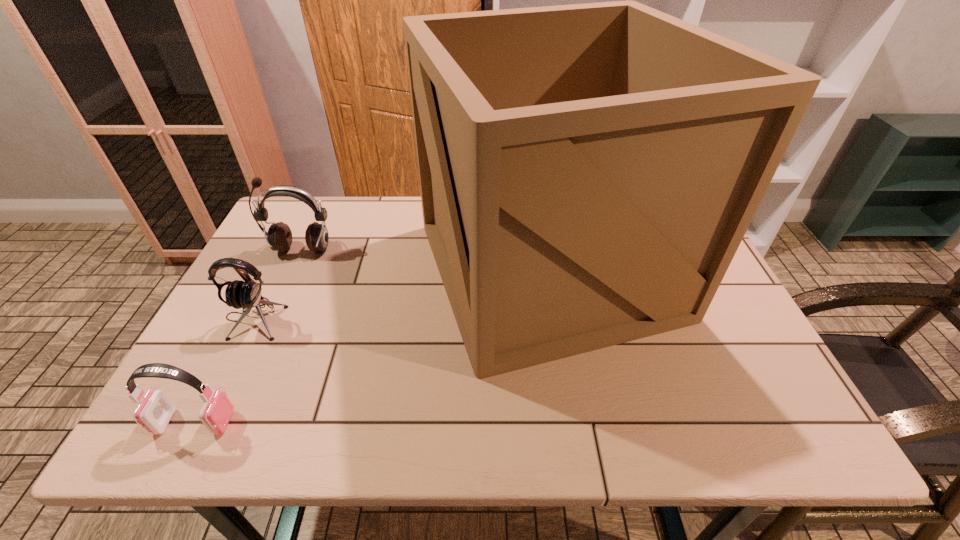
This screenshot has width=960, height=540. In order to click on free space at the far left corner in this screenshot , I will do `click(290, 228)`.

Identify the location of free point between the box and the second farthest earphone. (400, 294).

Locate an element on the screen. Image resolution: width=960 pixels, height=540 pixels. free space between the box and the farthest earphone is located at coordinates (424, 259).

Locate an element on the screen. The height and width of the screenshot is (540, 960). vacant space that is in between the farthest earphone and the second farthest earphone is located at coordinates (277, 284).

Locate an element on the screen. The image size is (960, 540). free spot between the box and the farthest earphone is located at coordinates (424, 259).

This screenshot has width=960, height=540. I want to click on free space between the box and the farthest earphone, so click(424, 259).

At what (x,y) coordinates should I click in order to perform the action: click on free spot between the rightmost object and the farthest earphone. Please return your answer as a coordinate pair (x, y). The height and width of the screenshot is (540, 960). Looking at the image, I should click on (424, 259).

Find the location of a particular element. This screenshot has width=960, height=540. free space between the farthest earphone and the second nearest earphone is located at coordinates [277, 284].

Where is `empty space between the second farthest earphone and the nearest object`? empty space between the second farthest earphone and the nearest object is located at coordinates (225, 370).

What are the coordinates of `free space between the farthest earphone and the nearest object` in the screenshot? It's located at (248, 335).